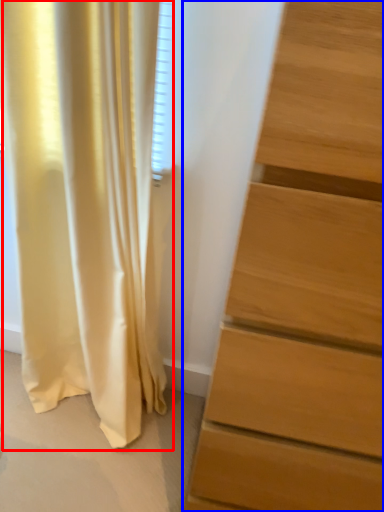
Question: Which object appears farthest to the camera in this image, curtain (highlighted by a red box) or chest of drawers (highlighted by a blue box)?

Choices:
 (A) curtain
 (B) chest of drawers

Answer: (A)